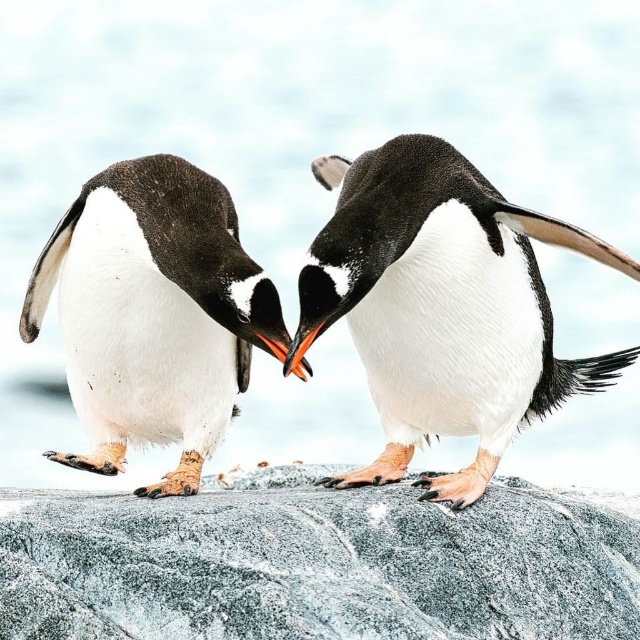
You are a wildlife photographer trying to capture a photo of the white fluffy penguin at center and the gray granite rock at center. From your current position, which object is located to the left?

The gray granite rock at center is positioned on the left side of the white fluffy penguin at center, so the gray granite rock at center is to the left of the white fluffy penguin at center.

You are a photographer aiming to capture the white fluffy penguin at center and the gray granite rock at center in a single frame. Based on their positions, which object should you focus on first to ensure both are in focus?

The gray granite rock at center is located below the white fluffy penguin at center, so you should focus on the gray granite rock at center first to ensure both are in focus since it is closer to the camera.